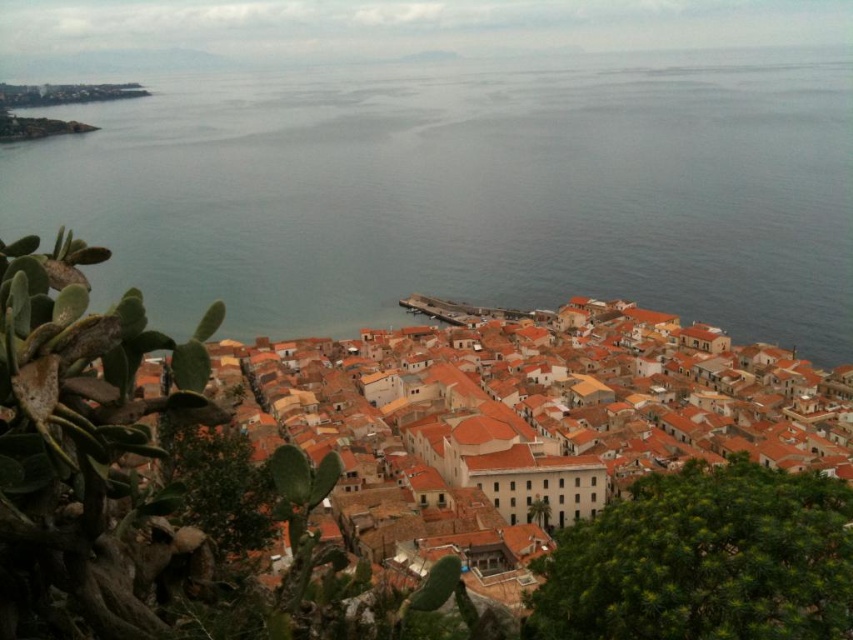
Question: Is smooth blue water at center closer to the viewer compared to orange clay rooftops at center?

Choices:
 (A) no
 (B) yes

Answer: (A)

Question: Is smooth blue water at center smaller than orange clay rooftops at center?

Choices:
 (A) yes
 (B) no

Answer: (B)

Question: Does smooth blue water at center have a greater width compared to orange clay rooftops at center?

Choices:
 (A) no
 (B) yes

Answer: (B)